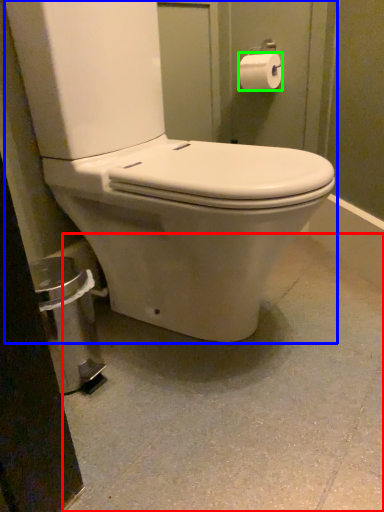
Question: Estimate the real-world distances between objects in this image. Which object is farther from concrete (highlighted by a red box), toilet (highlighted by a blue box) or toilet paper (highlighted by a green box)?

Choices:
 (A) toilet
 (B) toilet paper

Answer: (B)